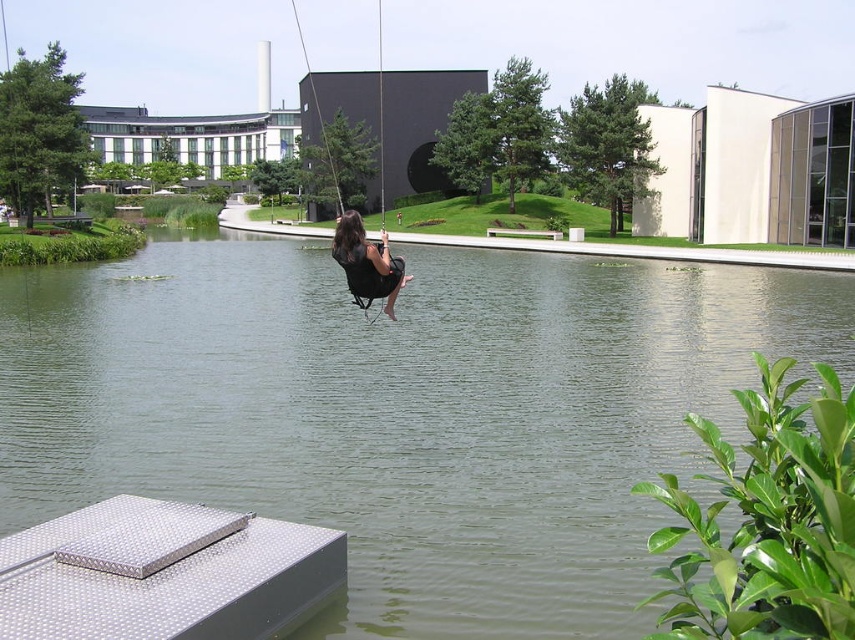
Image resolution: width=855 pixels, height=640 pixels. I want to click on green water at center, so click(401, 412).

Is green water at center to the right of black fabric swing at center from the viewer's perspective?

Indeed, green water at center is positioned on the right side of black fabric swing at center.

Does point (404, 307) lie behind point (337, 248)?

Yes, it is.

This screenshot has width=855, height=640. I want to click on green water at center, so click(x=401, y=412).

Can you confirm if green water at center is smaller than matte black swing at center?

Actually, green water at center might be larger than matte black swing at center.

Between green water at center and matte black swing at center, which one is positioned lower?

matte black swing at center is lower down.

You are a GUI agent. You are given a task and a screenshot of the screen. Output one action in this format:
    pyautogui.click(x=<x>, y=<y>)
    Task: Click on the green water at center
    Image resolution: width=855 pixels, height=640 pixels.
    Given the screenshot: What is the action you would take?
    pyautogui.click(x=401, y=412)

Does point (314, 84) come closer to viewer compared to point (346, 269)?

No, it is behind (346, 269).

Which is above, black fabric swing at center or matte black swing at center?

Positioned higher is black fabric swing at center.

Where is `black fabric swing at center`? Image resolution: width=855 pixels, height=640 pixels. black fabric swing at center is located at coordinates (354, 212).